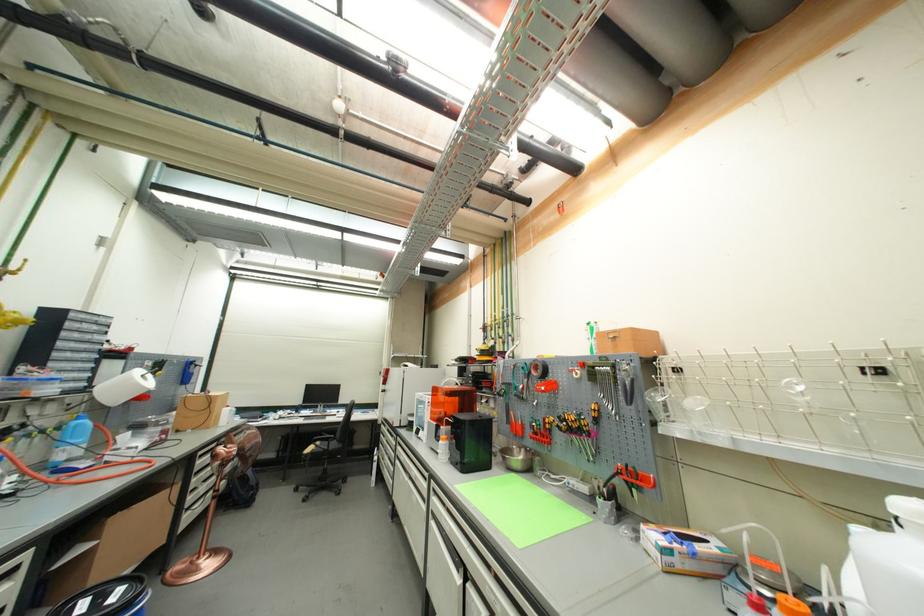
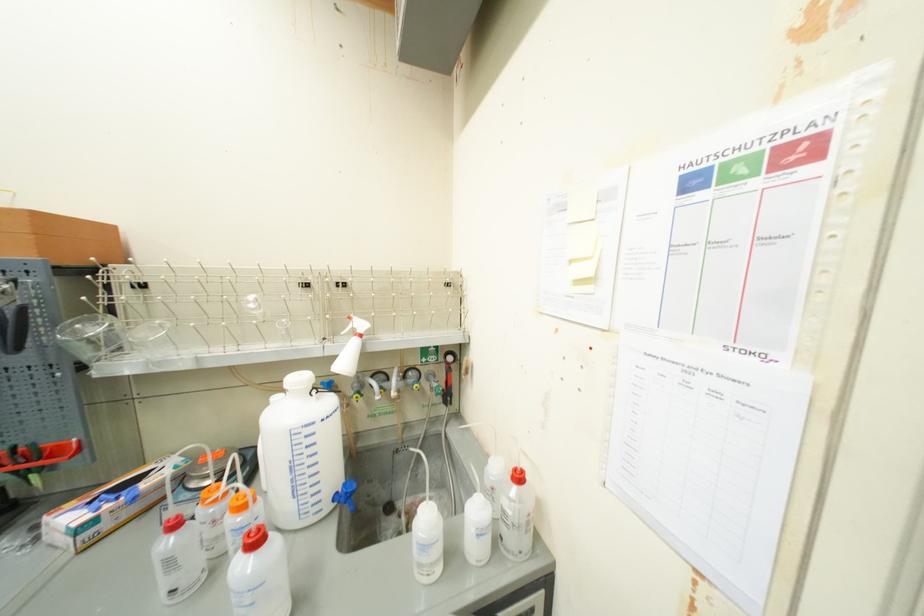
Locate, in the second image, the point that corresponds to point (659, 395) in the first image.

(83, 328)